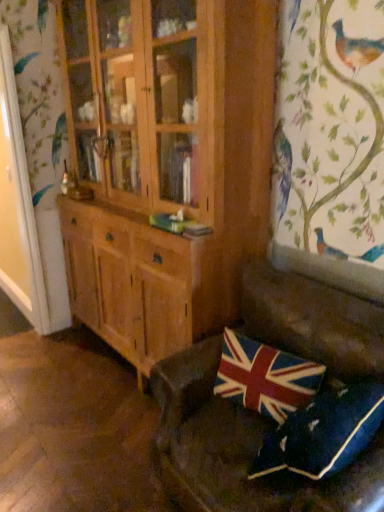
Question: Would you say wooden cabinet at center is a long distance from union jack fabric pillow at lower right, the 2th pillow positioned from the front?

Choices:
 (A) yes
 (B) no

Answer: (B)

Question: Does wooden cabinet at center contain union jack fabric pillow at lower right, which appears as the first pillow when viewed from the back?

Choices:
 (A) no
 (B) yes

Answer: (A)

Question: Is wooden cabinet at center turned away from union jack fabric pillow at lower right, which appears as the first pillow when viewed from the back?

Choices:
 (A) no
 (B) yes

Answer: (A)

Question: Is wooden cabinet at center oriented towards union jack fabric pillow at lower right, the 2th pillow positioned from the front?

Choices:
 (A) yes
 (B) no

Answer: (B)

Question: Considering the relative positions of wooden cabinet at center and union jack fabric pillow at lower right, which appears as the first pillow when viewed from the back, in the image provided, is wooden cabinet at center to the right of union jack fabric pillow at lower right, which appears as the first pillow when viewed from the back, from the viewer's perspective?

Choices:
 (A) no
 (B) yes

Answer: (A)

Question: From the image's perspective, is wooden cabinet at center on top of union jack fabric pillow at lower right, which appears as the first pillow when viewed from the back?

Choices:
 (A) no
 (B) yes

Answer: (B)

Question: Is union jack fabric pillow at lower right, which appears as the first pillow when viewed from the back, outside of velvet union jack pillow at lower right, which appears as the first pillow when viewed from the front?

Choices:
 (A) yes
 (B) no

Answer: (A)

Question: Does union jack fabric pillow at lower right, the 2th pillow positioned from the front, appear on the right side of velvet union jack pillow at lower right, which appears as the first pillow when viewed from the front?

Choices:
 (A) no
 (B) yes

Answer: (A)

Question: Is union jack fabric pillow at lower right, the 2th pillow positioned from the front, thinner than velvet union jack pillow at lower right, the second pillow when ordered from back to front?

Choices:
 (A) no
 (B) yes

Answer: (B)

Question: From the image's perspective, is union jack fabric pillow at lower right, which appears as the first pillow when viewed from the back, above velvet union jack pillow at lower right, which appears as the first pillow when viewed from the front?

Choices:
 (A) yes
 (B) no

Answer: (A)

Question: Is union jack fabric pillow at lower right, the 2th pillow positioned from the front, positioned in front of velvet union jack pillow at lower right, the second pillow when ordered from back to front?

Choices:
 (A) yes
 (B) no

Answer: (B)

Question: Is union jack fabric pillow at lower right, the 2th pillow positioned from the front, not near velvet union jack pillow at lower right, the second pillow when ordered from back to front?

Choices:
 (A) yes
 (B) no

Answer: (B)

Question: Is leather couch at lower right outside of union jack fabric pillow at lower right, which appears as the first pillow when viewed from the back?

Choices:
 (A) no
 (B) yes

Answer: (B)